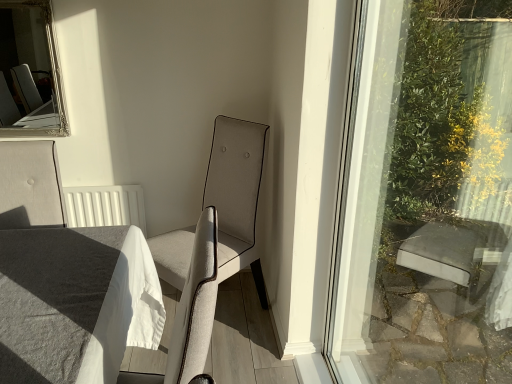
What do you see at coordinates (74, 303) in the screenshot? I see `white linen table at lower left` at bounding box center [74, 303].

Where is `white linen table at lower left`? white linen table at lower left is located at coordinates (74, 303).

Identify the location of light beige fabric chair at center. The height and width of the screenshot is (384, 512). click(236, 195).

In order to click on silver/gilded mirror at upper left in this screenshot , I will do `click(30, 72)`.

Image resolution: width=512 pixels, height=384 pixels. In order to click on white linen table at lower left in this screenshot , I will do `click(74, 303)`.

From a real-world perspective, is silver/gilded mirror at upper left physically above light beige fabric chair at center?

Yes.

Locate an element on the screen. bay window behind the light beige fabric chair at center is located at coordinates (30, 72).

Can you confirm if silver/gilded mirror at upper left is positioned to the left of light beige fabric chair at center?

Indeed, silver/gilded mirror at upper left is positioned on the left side of light beige fabric chair at center.

Is point (41, 16) closer or farther from the camera than point (213, 183)?

Point (41, 16).

Where is `chair on the right side of white linen table at lower left`? The width and height of the screenshot is (512, 384). chair on the right side of white linen table at lower left is located at coordinates (236, 195).

Which point is more distant from viewer, [16,333] or [218,265]?

Positioned behind is point [16,333].

Considering the relative sizes of white linen table at lower left and light beige fabric chair at center in the image provided, is white linen table at lower left taller than light beige fabric chair at center?

Incorrect, the height of white linen table at lower left is not larger of that of light beige fabric chair at center.

Based on the photo, from the image's perspective, is white linen table at lower left positioned above or below light beige fabric chair at center?

Based on their image positions, white linen table at lower left is located beneath light beige fabric chair at center.

Is light beige fabric chair at center taller or shorter than white linen table at lower left?

light beige fabric chair at center is taller than white linen table at lower left.

Consider the image. Which of these two, light beige fabric chair at center or white linen table at lower left, is thinner?

white linen table at lower left is thinner.

I want to click on table that is in front of the silver/gilded mirror at upper left, so click(74, 303).

Based on their sizes in the image, would you say white linen table at lower left is bigger or smaller than silver/gilded mirror at upper left?

Clearly, white linen table at lower left is larger in size than silver/gilded mirror at upper left.

From a real-world perspective, is white linen table at lower left positioned above or below silver/gilded mirror at upper left?

white linen table at lower left is situated lower than silver/gilded mirror at upper left in the real world.

Between white linen table at lower left and silver/gilded mirror at upper left, which one is positioned in front?

white linen table at lower left is in front.

Is silver/gilded mirror at upper left looking in the opposite direction of white linen table at lower left?

That's not correct — silver/gilded mirror at upper left is not looking away from white linen table at lower left.

Is silver/gilded mirror at upper left completely or partially outside of white linen table at lower left?

Yes.

Can you confirm if silver/gilded mirror at upper left is bigger than white linen table at lower left?

No.

From the picture: Does silver/gilded mirror at upper left touch white linen table at lower left?

No.

Looking at this image, who is more distant, light beige fabric chair at center or silver/gilded mirror at upper left?

Positioned behind is silver/gilded mirror at upper left.

Is light beige fabric chair at center surrounding silver/gilded mirror at upper left?

No.

Is point (219, 141) closer to viewer compared to point (22, 11)?

Yes, it is in front of point (22, 11).

Where is `bay window on the left of light beige fabric chair at center`? Image resolution: width=512 pixels, height=384 pixels. bay window on the left of light beige fabric chair at center is located at coordinates (30, 72).

What are the coordinates of `bay window behind the light beige fabric chair at center` in the screenshot? It's located at (30, 72).

Find the location of a particular element. This screenshot has width=512, height=384. table that is above the light beige fabric chair at center (from a real-world perspective) is located at coordinates (74, 303).

Considering their positions, is silver/gilded mirror at upper left positioned closer to white linen table at lower left than light beige fabric chair at center?

light beige fabric chair at center is closer to white linen table at lower left.

Estimate the real-world distances between objects in this image. Which object is closer to light beige fabric chair at center, silver/gilded mirror at upper left or white linen table at lower left?

white linen table at lower left is closer to light beige fabric chair at center.

Estimate the real-world distances between objects in this image. Which object is closer to light beige fabric chair at center, white linen table at lower left or silver/gilded mirror at upper left?

Among the two, white linen table at lower left is located nearer to light beige fabric chair at center.

Based on their spatial positions, is light beige fabric chair at center or silver/gilded mirror at upper left closer to white linen table at lower left?

The object closer to white linen table at lower left is light beige fabric chair at center.

Considering their positions, is light beige fabric chair at center positioned closer to silver/gilded mirror at upper left than white linen table at lower left?

Among the two, light beige fabric chair at center is located nearer to silver/gilded mirror at upper left.

When comparing their distances from silver/gilded mirror at upper left, does white linen table at lower left or light beige fabric chair at center seem further?

Based on the image, white linen table at lower left appears to be further to silver/gilded mirror at upper left.

You are a GUI agent. You are given a task and a screenshot of the screen. Output one action in this format:
    pyautogui.click(x=<x>, y=<y>)
    Task: Click on the chair between white linen table at lower left and silver/gilded mirror at upper left along the z-axis
    The image size is (512, 384).
    Given the screenshot: What is the action you would take?
    pyautogui.click(x=236, y=195)